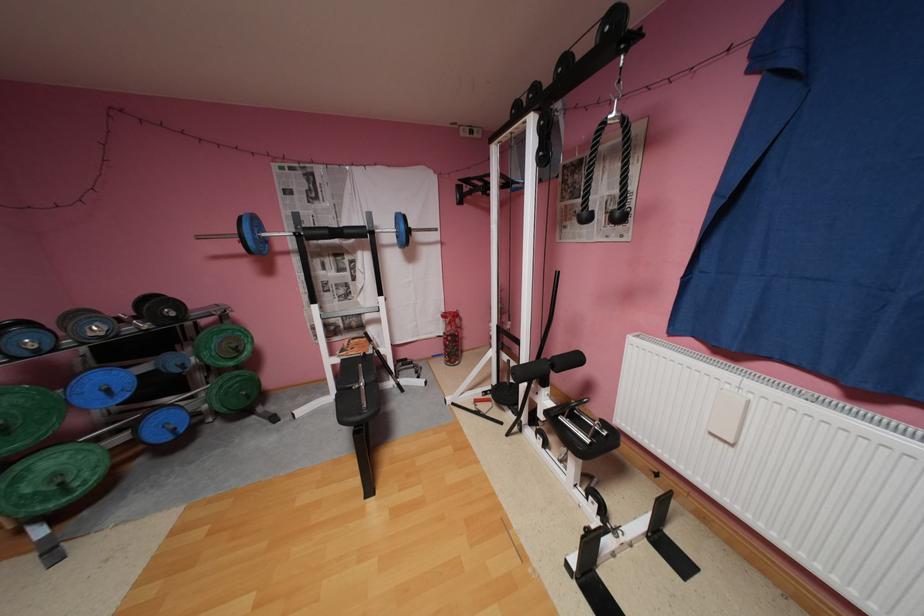
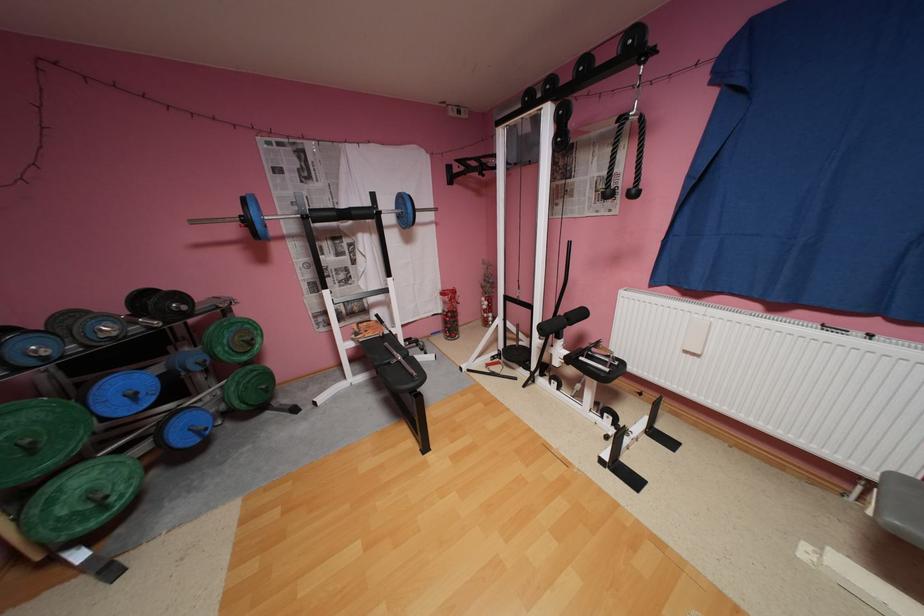
Question: What movement of the cameraman would produce the second image?

Choices:
 (A) Left
 (B) Right
 (C) Forward
 (D) Backward

Answer: (A)